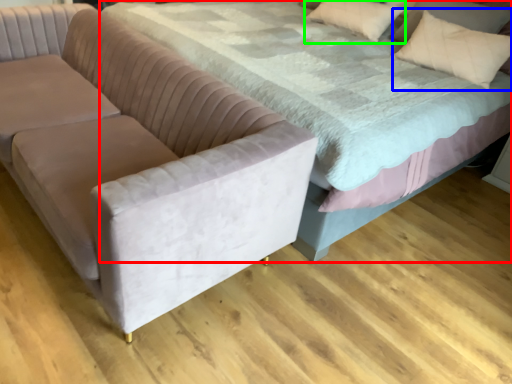
Question: Which is nearer to the bed (highlighted by a red box)? throw pillow (highlighted by a blue box) or pillow (highlighted by a green box).

Choices:
 (A) throw pillow
 (B) pillow

Answer: (A)